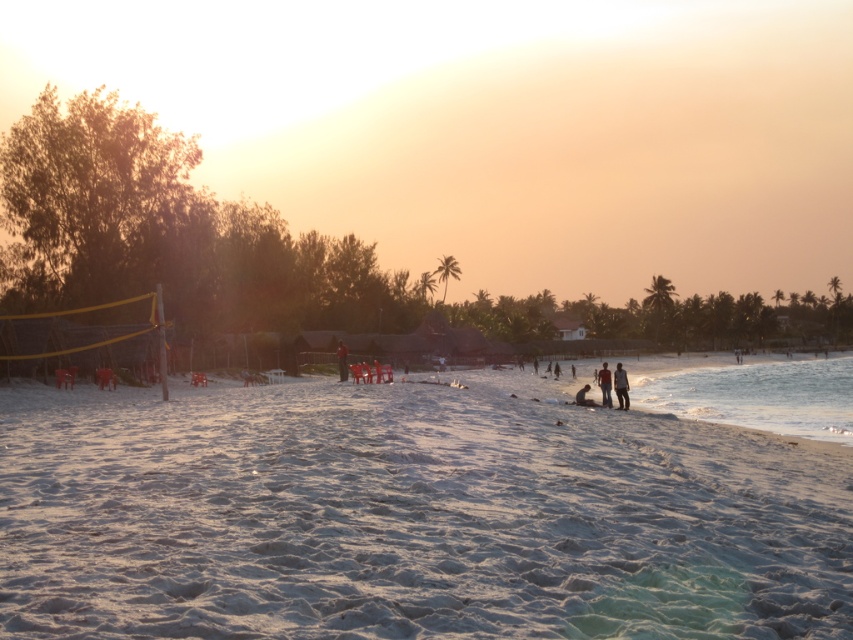
Is light brown wooden surfboard at center wider than blurred human figure at center?

Incorrect, light brown wooden surfboard at center's width does not surpass blurred human figure at center's.

Can you confirm if light brown wooden surfboard at center is positioned above blurred human figure at center?

No, light brown wooden surfboard at center is not above blurred human figure at center.

Find the location of a particular element. light brown wooden surfboard at center is located at coordinates (619, 387).

You are a GUI agent. You are given a task and a screenshot of the screen. Output one action in this format:
    pyautogui.click(x=<x>, y=<y>)
    Task: Click on the light brown wooden surfboard at center
    The height and width of the screenshot is (640, 853).
    Given the screenshot: What is the action you would take?
    pyautogui.click(x=619, y=387)

Between white sandy beach at center and light brown wooden surfboard at center, which one is positioned higher?

light brown wooden surfboard at center

Is point (196, 560) behind point (619, 385)?

That is False.

Between point (231, 624) and point (619, 408), which one is positioned in front?

Point (231, 624) is in front.

Locate an element on the screen. The width and height of the screenshot is (853, 640). white sandy beach at center is located at coordinates (410, 516).

Describe the element at coordinates (410, 516) in the screenshot. I see `white sandy beach at center` at that location.

Looking at this image, can you confirm if white sandy beach at center is taller than blurred human figure at center?

No.

The height and width of the screenshot is (640, 853). What do you see at coordinates (410, 516) in the screenshot?
I see `white sandy beach at center` at bounding box center [410, 516].

Locate an element on the screen. The width and height of the screenshot is (853, 640). white sandy beach at center is located at coordinates (410, 516).